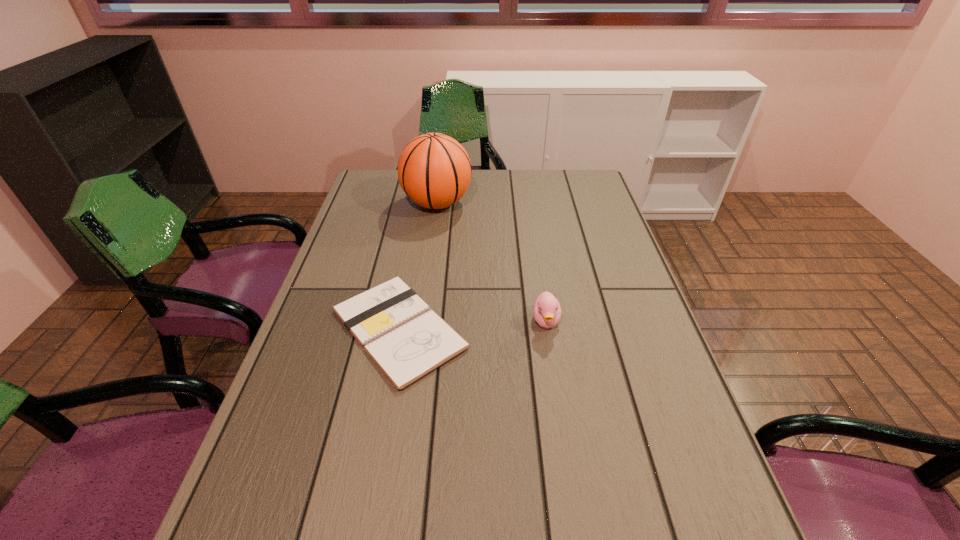
Locate an element on the screen. The height and width of the screenshot is (540, 960). vacant area that lies between the basketball and the second shortest object is located at coordinates (492, 262).

The width and height of the screenshot is (960, 540). Identify the location of free space between the farthest object and the shortest object. (419, 266).

Identify the location of blank region between the duckling and the farthest object. 492,262.

Image resolution: width=960 pixels, height=540 pixels. Find the location of `unoccupied area between the second shortest object and the tallest object`. unoccupied area between the second shortest object and the tallest object is located at coordinates (492, 262).

Where is `free space between the shortest object and the basketball`? free space between the shortest object and the basketball is located at coordinates (419, 266).

Locate an element on the screen. The height and width of the screenshot is (540, 960). vacant region between the rightmost object and the tallest object is located at coordinates (492, 262).

The height and width of the screenshot is (540, 960). Identify the location of object that ranks as the closest to the second shortest object. (407, 341).

Locate an element on the screen. This screenshot has height=540, width=960. object that can be found as the closest to the second shortest object is located at coordinates (407, 341).